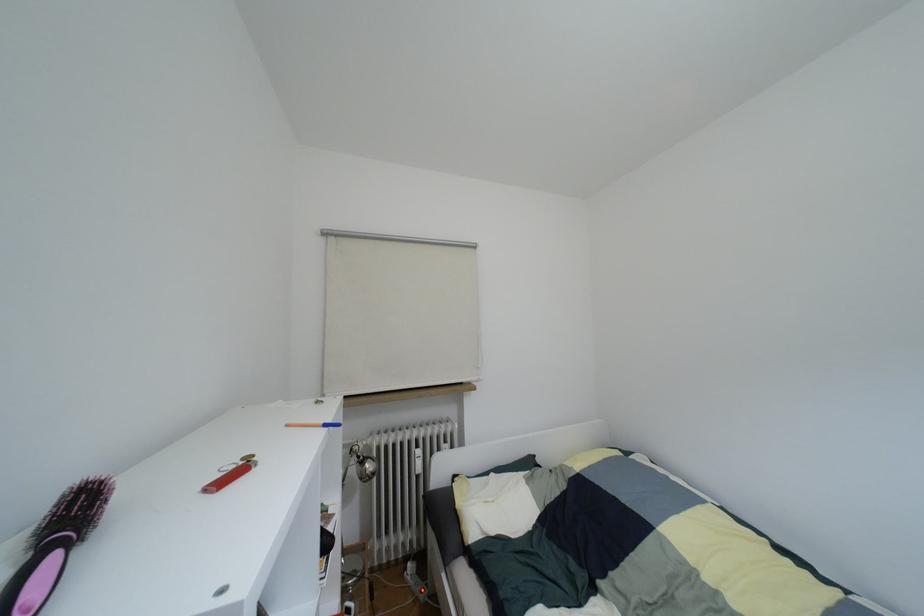
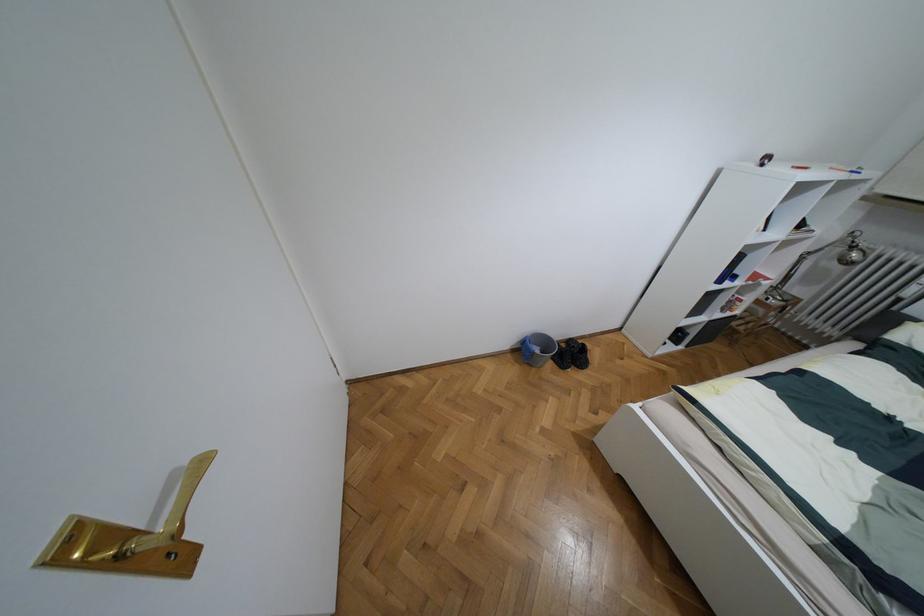
Locate, in the second image, the point that corresponds to pixel 360 461 in the first image.

(852, 246)